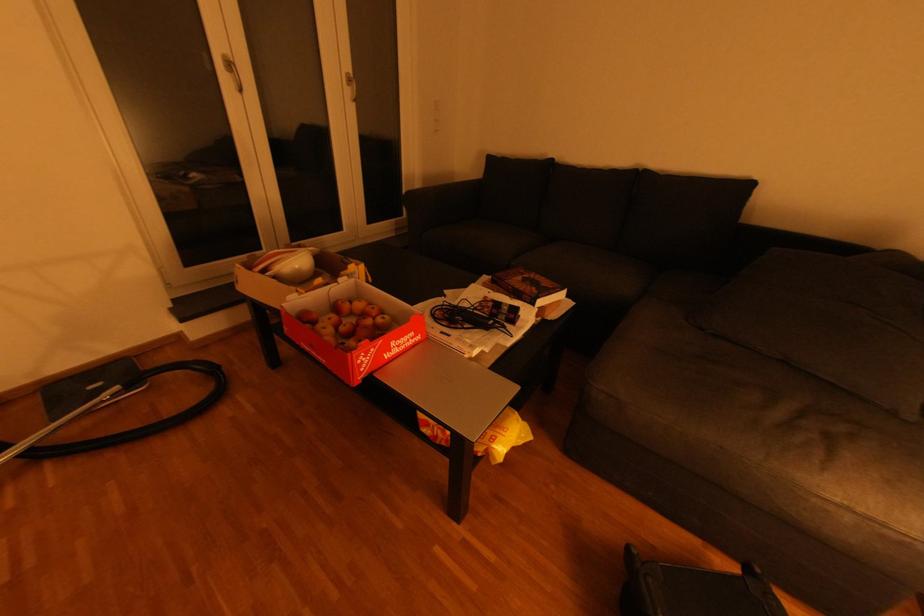
What are the coordinates of `black case handle` in the screenshot? It's located at (636, 586).